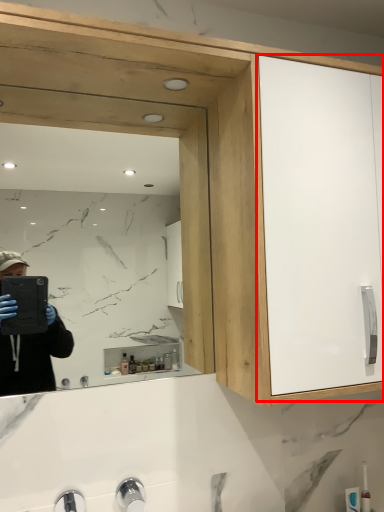
Question: Considering the relative positions of glass door (annotated by the red box) and mirror in the image provided, where is glass door (annotated by the red box) located with respect to the staircase?

Choices:
 (A) right
 (B) left

Answer: (A)